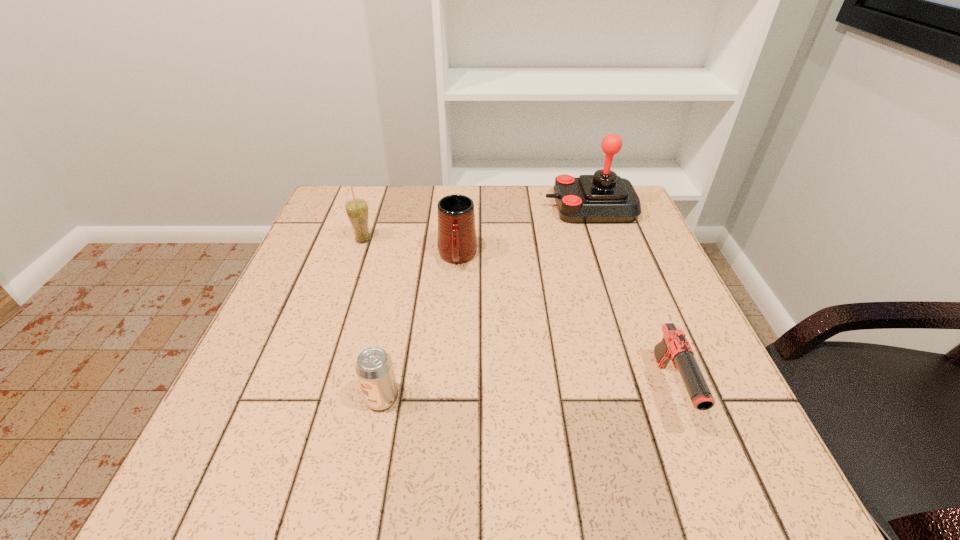
The width and height of the screenshot is (960, 540). In order to click on free spot at the near edge of the desktop in this screenshot , I will do `click(314, 465)`.

This screenshot has height=540, width=960. I want to click on free location at the left edge, so click(270, 351).

Where is `vacant area at the right edge`? The height and width of the screenshot is (540, 960). vacant area at the right edge is located at coordinates (640, 252).

Image resolution: width=960 pixels, height=540 pixels. What are the coordinates of `free space at the near left corner of the desktop` in the screenshot? It's located at (212, 500).

The image size is (960, 540). I want to click on vacant area at the far right corner of the desktop, so click(621, 232).

Find the location of a particular element. This screenshot has width=960, height=540. vacant space at the near right corner of the desktop is located at coordinates (685, 485).

Locate an element on the screen. Image resolution: width=960 pixels, height=540 pixels. blank region between the third shortest object and the beer can is located at coordinates (420, 328).

The image size is (960, 540). What are the coordinates of `empty location between the second object from left to right and the mug` in the screenshot? It's located at (420, 328).

Locate an element on the screen. The width and height of the screenshot is (960, 540). free space between the beer can and the leftmost object is located at coordinates (372, 319).

Find the location of a particular element. empty space that is in between the farthest object and the straw for drinking is located at coordinates (476, 224).